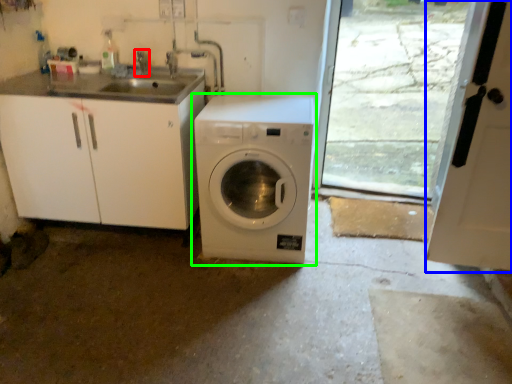
Question: Estimate the real-world distances between objects in this image. Which object is farther from faucet (highlighted by a red box), screen door (highlighted by a blue box) or washing machine (highlighted by a green box)?

Choices:
 (A) screen door
 (B) washing machine

Answer: (A)